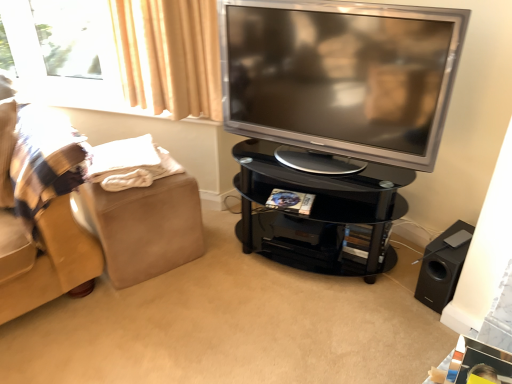
Locate an element on the screen. vacant space behind black matte speaker at lower right is located at coordinates (407, 251).